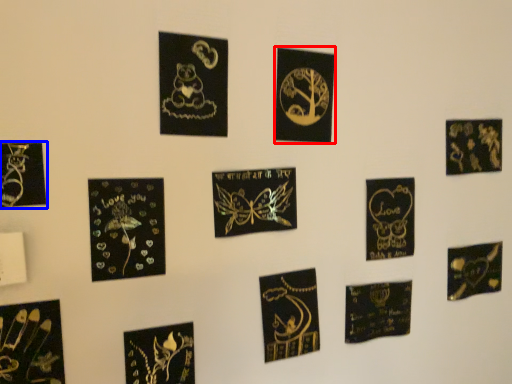
Question: Which object is further to the camera taking this photo, picture frame (highlighted by a red box) or picture frame (highlighted by a blue box)?

Choices:
 (A) picture frame
 (B) picture frame

Answer: (A)